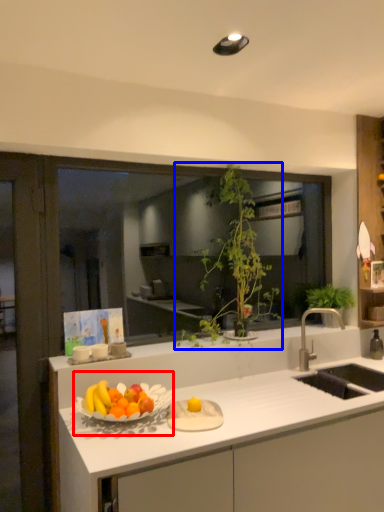
Question: Which of the following is the closest to the observer, fruit dish (highlighted by a red box) or houseplant (highlighted by a blue box)?

Choices:
 (A) fruit dish
 (B) houseplant

Answer: (A)